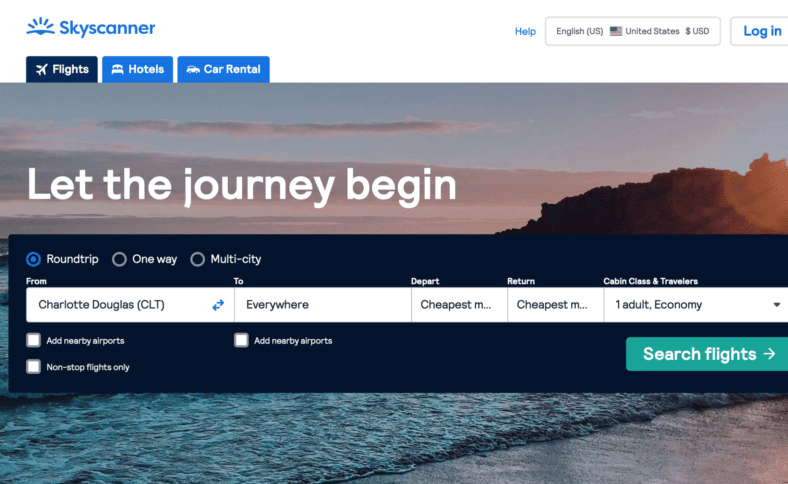
Locate an element on the screen. hotel is located at coordinates (116, 71).